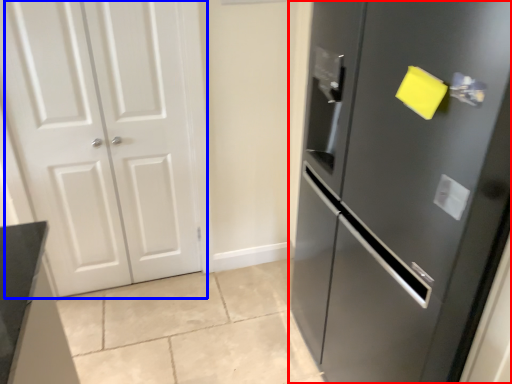
Question: Which object is closer to the camera taking this photo, door (highlighted by a red box) or door (highlighted by a blue box)?

Choices:
 (A) door
 (B) door

Answer: (A)